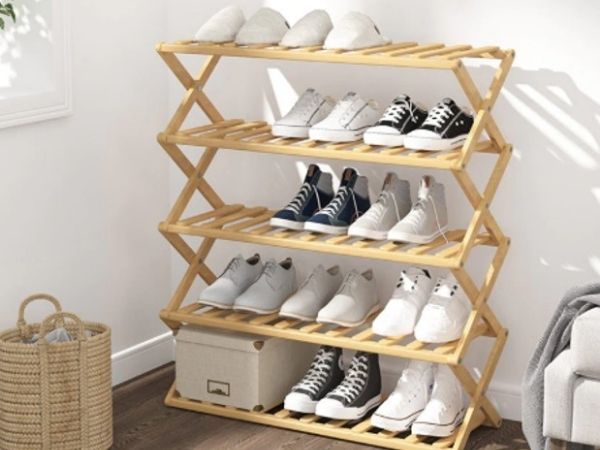
Locate an element on the screen. shoes on top shelf is located at coordinates (205, 32), (256, 31), (297, 34), (354, 35).